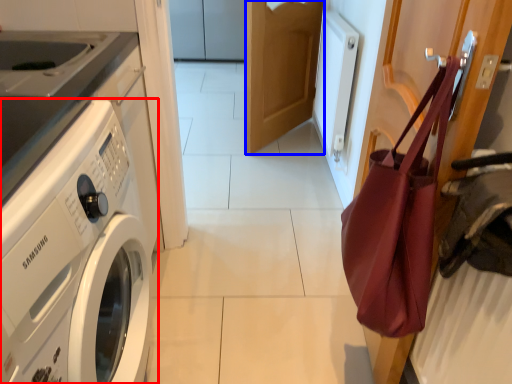
Question: Which point is further to the camera, washing machine (highlighted by a red box) or door (highlighted by a blue box)?

Choices:
 (A) washing machine
 (B) door

Answer: (B)